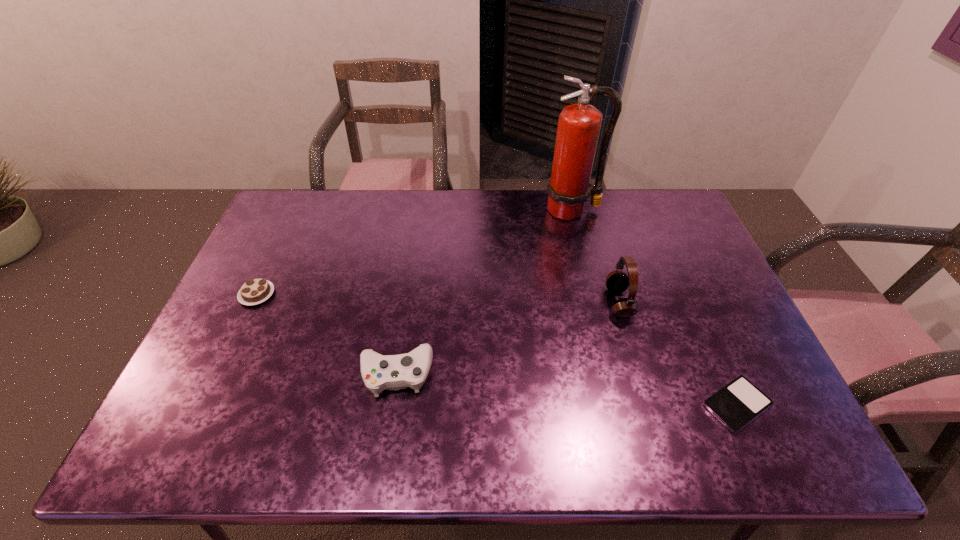
Where is `vacant point located between the second object from left to right and the shortest object`? This screenshot has width=960, height=540. vacant point located between the second object from left to right and the shortest object is located at coordinates (566, 389).

The width and height of the screenshot is (960, 540). Find the location of `vacant region between the second object from left to right and the chocolate cake`. vacant region between the second object from left to right and the chocolate cake is located at coordinates (326, 334).

The height and width of the screenshot is (540, 960). What are the coordinates of `free space between the fourth object from right to left and the second shortest object` in the screenshot? It's located at (326, 334).

This screenshot has width=960, height=540. Find the location of `vacant space in between the chocolate cake and the headset`. vacant space in between the chocolate cake and the headset is located at coordinates (438, 298).

The image size is (960, 540). Identify the location of unoccupied area between the second tallest object and the chocolate cake. (438, 298).

Image resolution: width=960 pixels, height=540 pixels. I want to click on free space between the third shortest object and the farthest object, so click(484, 292).

The height and width of the screenshot is (540, 960). What are the coordinates of `vacant area that lies between the chocolate cake and the tallest object` in the screenshot? It's located at (415, 252).

Find the location of a particular element. The height and width of the screenshot is (540, 960). vacant space in between the fourth shortest object and the control is located at coordinates (508, 338).

Find the location of a particular element. the third closest object to the control is located at coordinates (579, 125).

Identify the location of object that is the closest one to the chocolate cake. (394, 372).